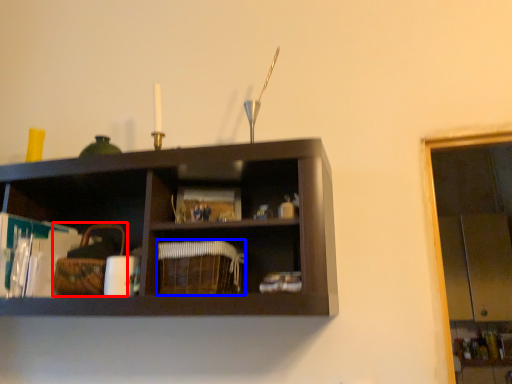
Question: Which object is closer to the camera taking this photo, basket (highlighted by a red box) or basket (highlighted by a blue box)?

Choices:
 (A) basket
 (B) basket

Answer: (B)